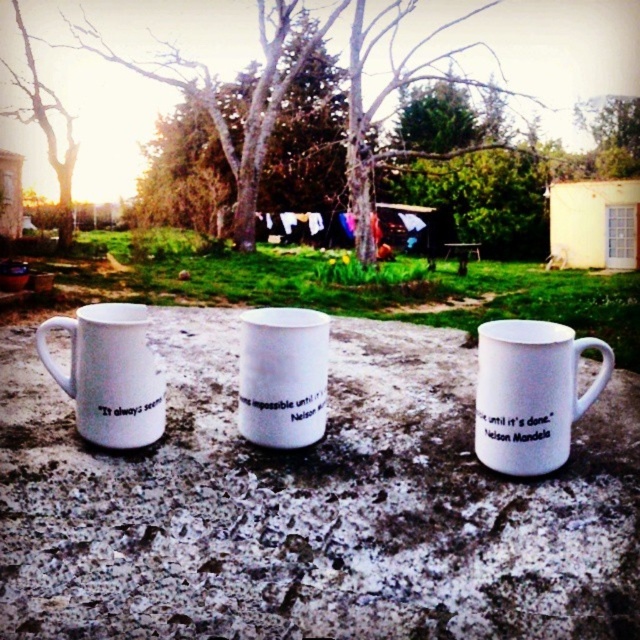
Based on the photo, you are a delivery robot with a 25 cm wide arm. You need to place a new mug between the white matte mug at left and the white matte mug at center. Can your arm fit between them without moving the existing mugs?

The white matte mug at left and white matte mug at center are 24.76 centimeters apart from each other. Since your arm is 25 cm wide, it can barely fit between them as the space is slightly less than the arm width. However, you might need to adjust carefully to avoid touching the existing mugs.

You are standing at the origin point in the image and want to place a new mug exactly 0.2 units to the right of the white ceramic mug at center. What are the coordinates of the new mug?

The white ceramic mug at center is located at coordinates point (531, 394). Adding 0.2 units to the x coordinate gives 0.816, so the new mug should be placed at point (531, 522).

You are standing in front of the three white ceramic mugs on the stone surface. You want to pick up the mug that is nearest to you. Which one should you choose between the white matte mug at left and the white matte mug at center?

The white matte mug at left is closer to the viewer than the white matte mug at center, so you should pick up the white matte mug at left.